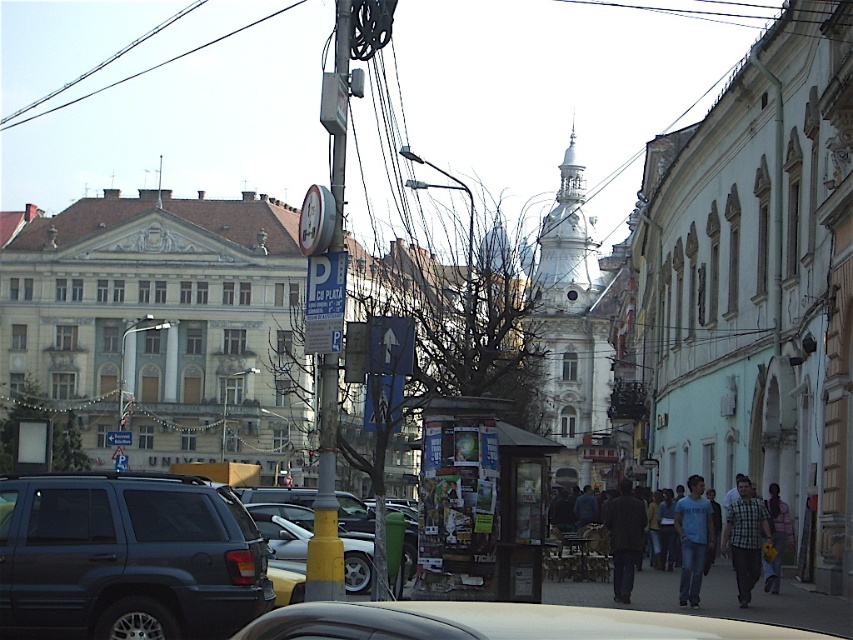
Based on the photo, you are a pedestrian standing on the sidewalk in the scene. You see the yellow painted metal pole at center and the plaid shirt at lower right. Which object is closer to the left side of the image?

The yellow painted metal pole at center is to the left of the plaid shirt at lower right, so it is closer to the left side of the image.

You are a fashion designer observing people on the street. You notice two individuals wearing a checkered fabric shirt at center and a plaid shirt at lower right. Which individual is positioned more to the left side of the scene?

The checkered fabric shirt at center is positioned to the left of the plaid shirt at lower right, so the individual wearing the checkered fabric shirt at center is more to the left side of the scene.

You are standing at the entrance of the large ornate building on the left and want to find the yellow painted metal pole at center. According to the scene description, where should you look relative to your current position?

The yellow painted metal pole at center is located at point (326,497), so you should look towards the center of the image, slightly to the right and forward from your current position at the entrance of the large ornate building on the left.